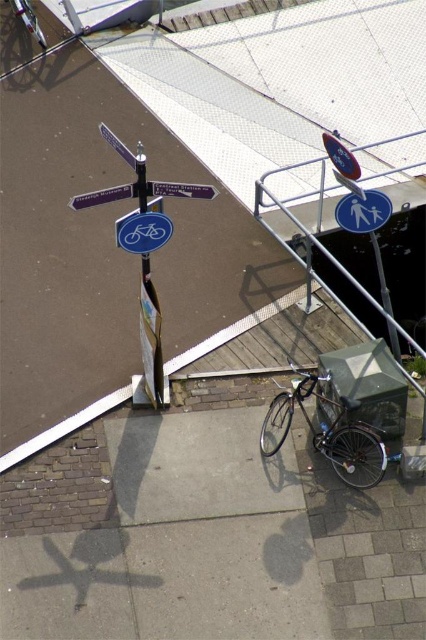
You are a cyclist who wants to find a bike rack. You see the blue glossy bicycle sign at center and the blue plastic street sign at upper left. Which one is closer to your current position if you are standing in the middle of the paved area?

The blue plastic street sign at upper left is closer to your current position because it is located to the left of the blue glossy bicycle sign at center, which is further to the right.

Looking at this image, you are a delivery person trying to navigate through the city. You see the blue glossy bicycle sign at center and the blue plastic street sign at upper left. Which one is shorter in height?

The blue glossy bicycle sign at center is not as tall as the blue plastic street sign at upper left, so the blue glossy bicycle sign at center is shorter.

Consider the image. You are a cyclist who wants to park your shiny metallic bicycle at center near the blue plastic street sign at upper left. Is there enough space between the bicycle and the sign to fit a small backpack?

The shiny metallic bicycle at center is positioned under blue plastic street sign at upper left, so there should be enough vertical space between them to fit a small backpack.